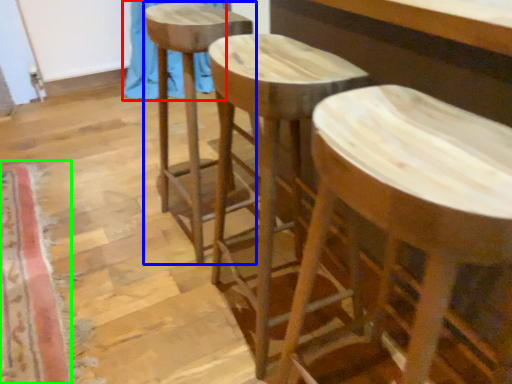
Question: Estimate the real-world distances between objects in this image. Which object is closer to curtain (highlighted by a red box), stool (highlighted by a blue box) or mat (highlighted by a green box)?

Choices:
 (A) stool
 (B) mat

Answer: (A)